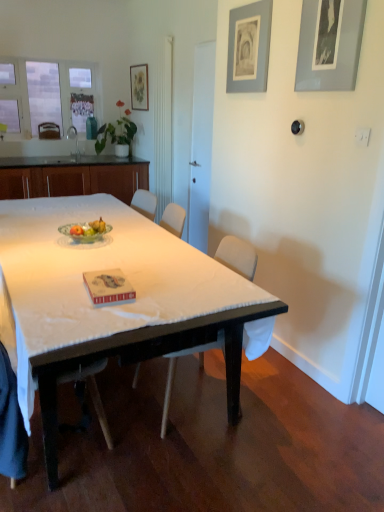
The height and width of the screenshot is (512, 384). Find the location of `spots to the right of white wood chair at center, the 1th chair in the front-to-back sequence`. spots to the right of white wood chair at center, the 1th chair in the front-to-back sequence is located at coordinates pos(136,458).